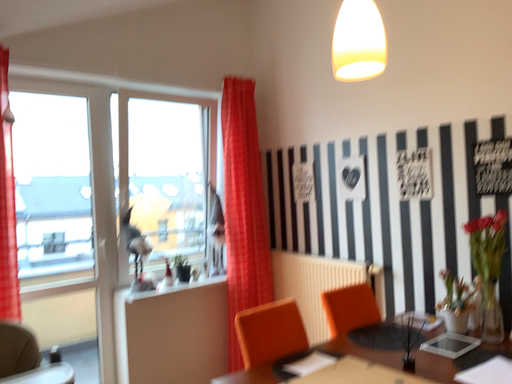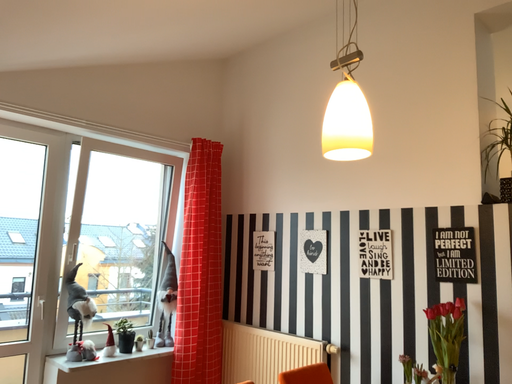
Question: Which way did the camera rotate in the video?

Choices:
 (A) rotated upward
 (B) rotated downward

Answer: (A)